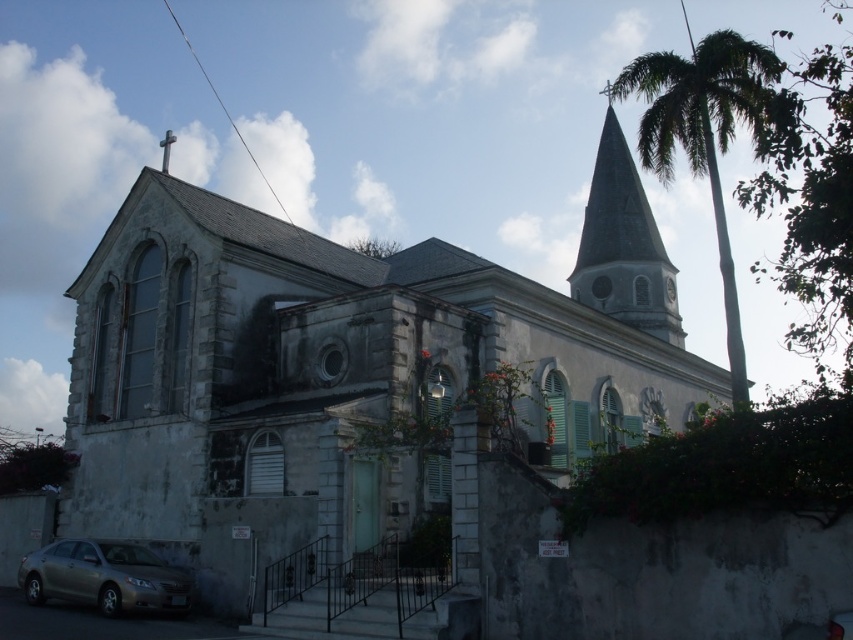
You are standing in front of the historic church and notice both the green leafy palm tree at upper right and the smooth gray steeple at upper right. Which object appears bigger in the image?

The green leafy palm tree at upper right is larger in size than the smooth gray steeple at upper right, so the palm tree appears bigger in the image.

You are standing in front of the historic church and notice two landmarks. The gray stone church at center and the white stone clock at upper center. Which one is positioned to the left when viewed from the front?

The gray stone church at center is positioned to the left of the white stone clock at upper center when viewed from the front.